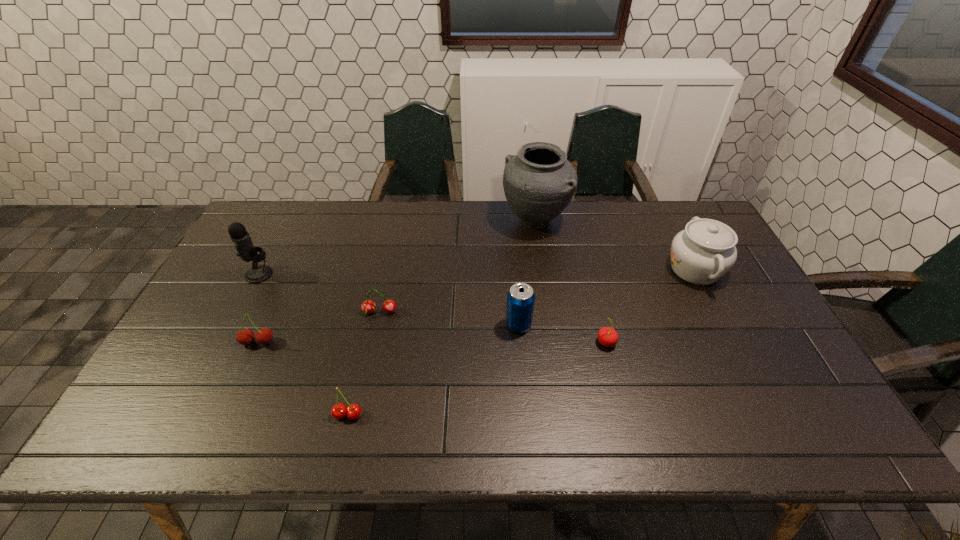
Locate an element on the screen. The width and height of the screenshot is (960, 540). the farthest object is located at coordinates (x=539, y=182).

Locate an element on the screen. The height and width of the screenshot is (540, 960). urn is located at coordinates (539, 182).

This screenshot has width=960, height=540. What are the coordinates of `the leftmost object` in the screenshot? It's located at (240, 237).

At what (x,y) coordinates should I click in order to perform the action: click on microphone. Please return your answer as a coordinate pair (x, y). Looking at the image, I should click on point(240,237).

The image size is (960, 540). I want to click on chinaware, so click(x=702, y=253).

Image resolution: width=960 pixels, height=540 pixels. I want to click on the sixth shortest object, so click(702, 253).

At what (x,y) coordinates should I click in order to perform the action: click on pop soda. Please return your answer as a coordinate pair (x, y). Looking at the image, I should click on (520, 298).

Locate an element on the screen. the leftmost cherry is located at coordinates (245, 336).

Where is `the tallest cherry`? The height and width of the screenshot is (540, 960). the tallest cherry is located at coordinates (245, 336).

Identify the location of the rightmost cherry. (607, 336).